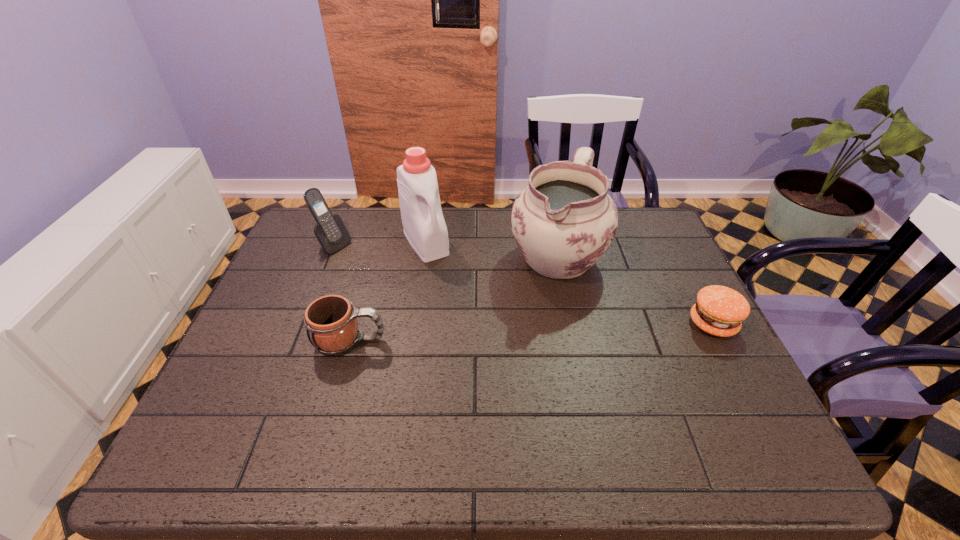
The height and width of the screenshot is (540, 960). I want to click on free space on the desktop that is between the mug and the rightmost object and is positioned on the front-facing side of the third shortest object, so click(x=487, y=334).

Where is `free space on the desktop that is between the mug and the rightmost object and is positioned on the spout of the second object from right to left`? free space on the desktop that is between the mug and the rightmost object and is positioned on the spout of the second object from right to left is located at coordinates (492, 334).

What are the coordinates of `vacant space on the desktop that is between the mug and the rightmost object and is positioned on the handle side of the detergent` in the screenshot? It's located at (487, 334).